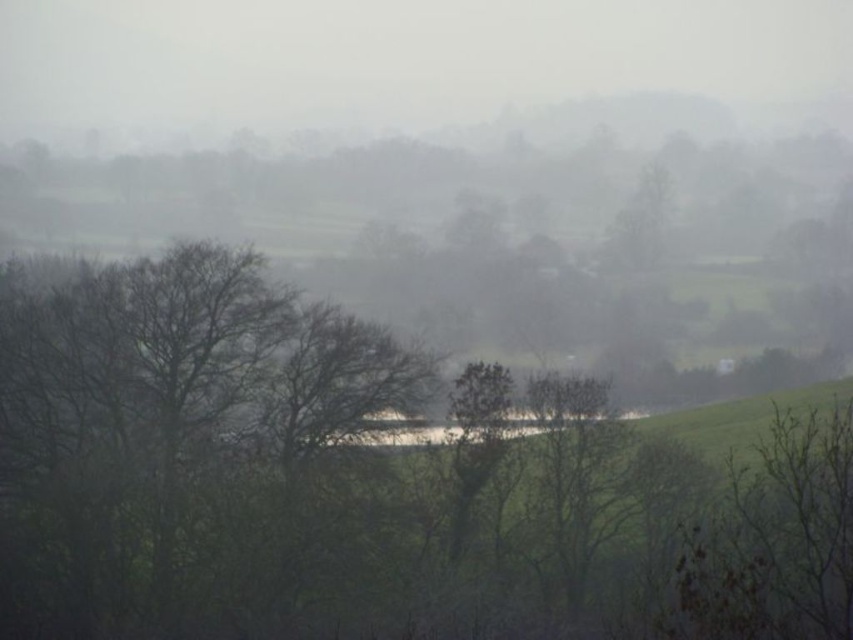
You are standing in the misty rural landscape and want to move from the point at coordinates point (x=67, y=508) to the point at coordinates point (x=761, y=637). Which direction should you face to move towards the second point?

You should face away from the camera because point (x=67, y=508) is closer to the camera than point (x=761, y=637), so moving towards the second point requires facing away from the camera.